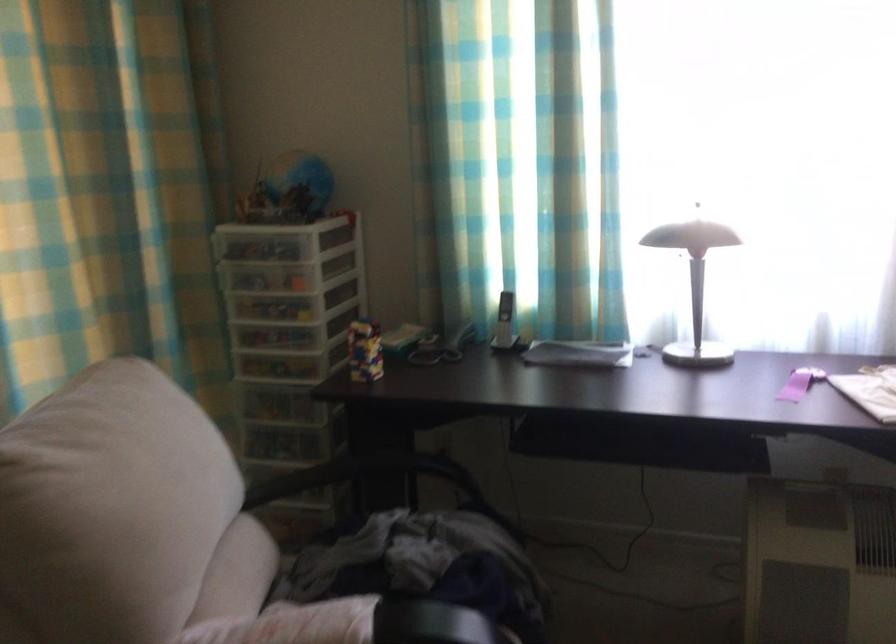
Where would you lift the telephone handset? Please return your answer as a coordinate pair (x, y).

(504, 322)